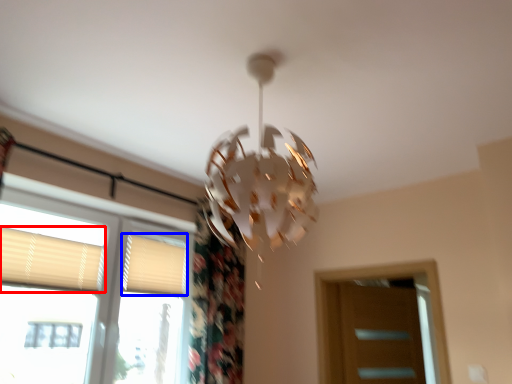
Question: Which object appears farthest to the camera in this image, shutter (highlighted by a red box) or shutter (highlighted by a blue box)?

Choices:
 (A) shutter
 (B) shutter

Answer: (B)